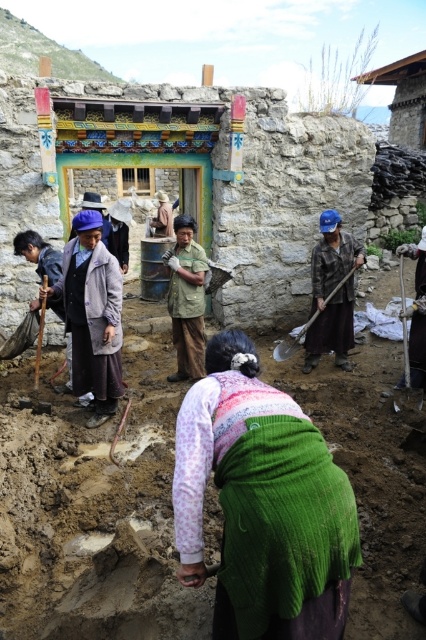
Is blue fabric hat at center shorter than wooden roof at upper center?

Yes, blue fabric hat at center is shorter than wooden roof at upper center.

Is blue fabric hat at center to the right of wooden roof at upper center from the viewer's perspective?

No, blue fabric hat at center is not to the right of wooden roof at upper center.

Where is `blue fabric hat at center`? Image resolution: width=426 pixels, height=640 pixels. blue fabric hat at center is located at coordinates (333, 294).

Does brown clay at center have a lesser width compared to dark brown wooden stick at left?

No, brown clay at center is not thinner than dark brown wooden stick at left.

Who is taller, brown clay at center or dark brown wooden stick at left?

Standing taller between the two is dark brown wooden stick at left.

Which is behind, point (129, 461) or point (25, 241)?

The point (25, 241) is behind.

Image resolution: width=426 pixels, height=640 pixels. I want to click on brown clay at center, so click(91, 513).

Between wooden roof at upper center and wooden shovel at center, which one appears on the left side from the viewer's perspective?

Positioned to the left is wooden shovel at center.

Between point (416, 106) and point (316, 308), which one is positioned in front?

Point (316, 308) is in front.

You are a GUI agent. You are given a task and a screenshot of the screen. Output one action in this format:
    pyautogui.click(x=<x>, y=<y>)
    Task: Click on the wooden roof at upper center
    The height and width of the screenshot is (640, 426).
    Given the screenshot: What is the action you would take?
    pyautogui.click(x=403, y=97)